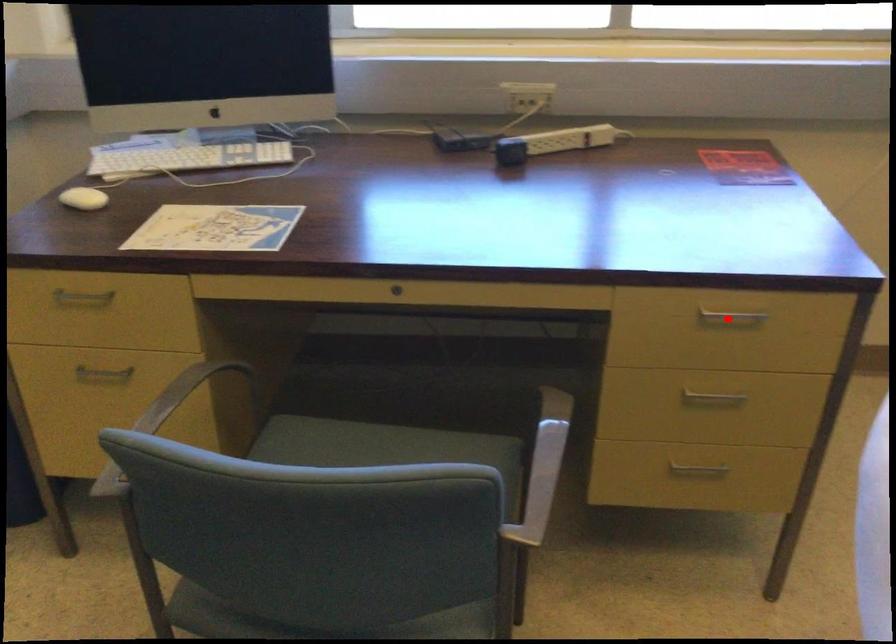
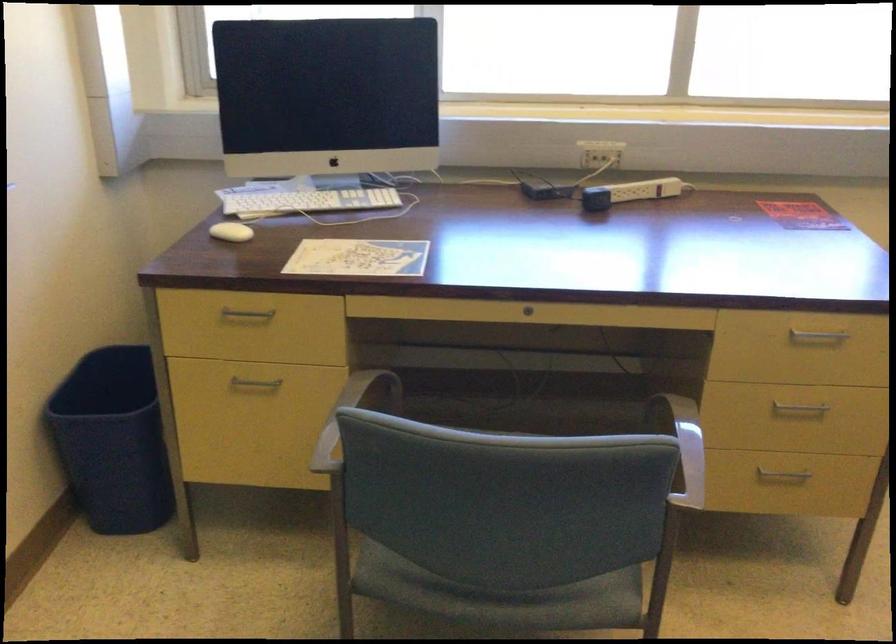
Question: I am providing you with two images of the same scene from different viewpoints. Given a red point in image1, look at the same physical point in image2. Is it:

Choices:
 (A) Closer to the viewpoint
 (B) Farther from the viewpoint

Answer: (B)